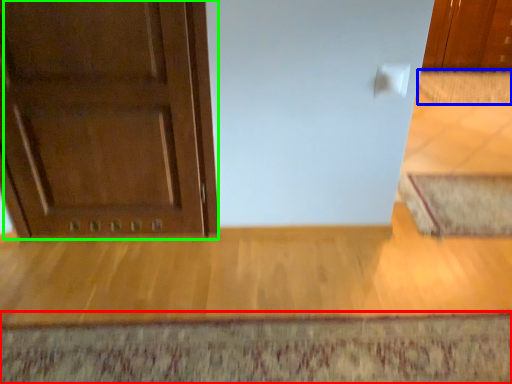
Question: Considering the real-world distances, which object is farthest from doormat (highlighted by a red box)? doormat (highlighted by a blue box) or door (highlighted by a green box)?

Choices:
 (A) doormat
 (B) door

Answer: (A)